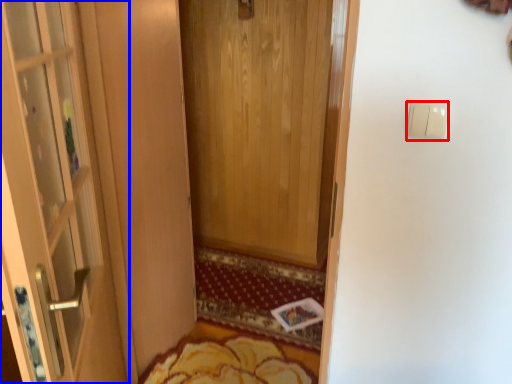
Question: Which of the following is the farthest to the observer, light switch (highlighted by a red box) or door (highlighted by a blue box)?

Choices:
 (A) light switch
 (B) door

Answer: (A)